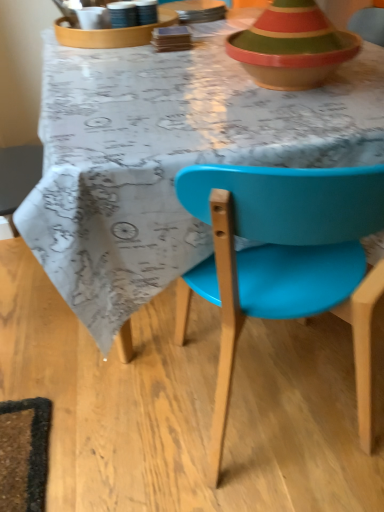
Locate an element on the screen. This screenshot has height=512, width=384. vacant area that lies in front of matte white tray at upper center, positioned as the second tableware in right-to-left order is located at coordinates (148, 69).